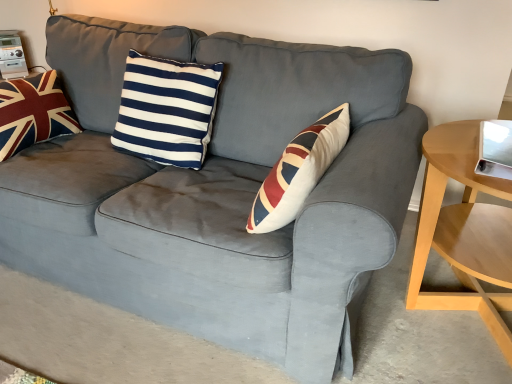
Question: Considering the positions of navy/white striped cushion at center, which ranks as the second pillow in left-to-right order, and velvet union jack pillow at left, placed as the 1th pillow when sorted from left to right, in the image, is navy/white striped cushion at center, which ranks as the second pillow in left-to-right order, wider or thinner than velvet union jack pillow at left, placed as the 1th pillow when sorted from left to right,?

Choices:
 (A) wide
 (B) thin

Answer: (B)

Question: Relative to velvet union jack pillow at left, which ranks as the second pillow in right-to-left order, is navy/white striped cushion at center, which ranks as the second pillow in left-to-right order, in front or behind?

Choices:
 (A) behind
 (B) front

Answer: (B)

Question: Estimate the real-world distances between objects in this image. Which object is farther from the velvet union jack pillow at left, which ranks as the second pillow in right-to-left order?

Choices:
 (A) navy/white striped cushion at center, which ranks as the second pillow in left-to-right order
 (B) light wood/woodenobject at right

Answer: (B)

Question: Estimate the real-world distances between objects in this image. Which object is closer to the light wood/woodenobject at right?

Choices:
 (A) velvet union jack pillow at left, placed as the 1th pillow when sorted from left to right
 (B) navy/white striped cushion at center, the 1th pillow positioned from the right

Answer: (B)